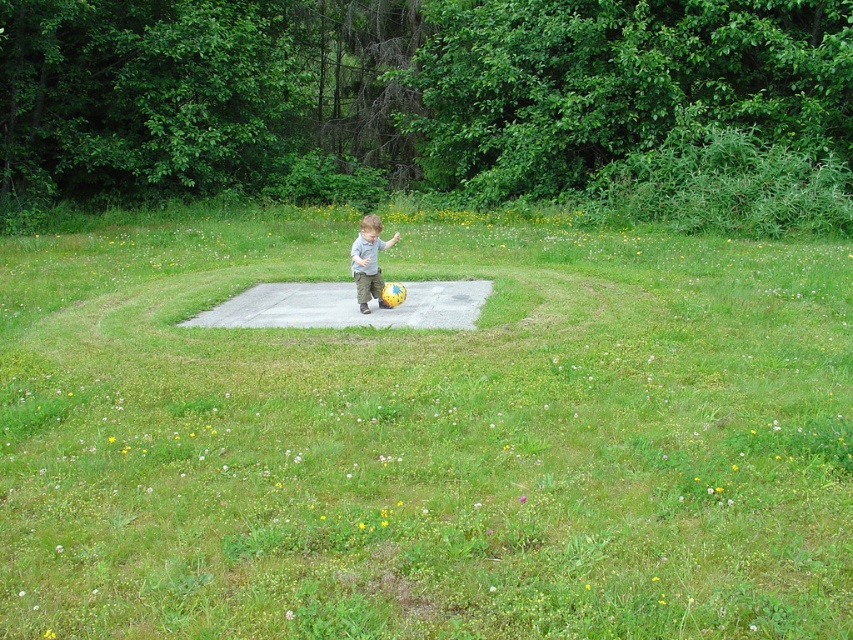
Question: Which point is closer to the camera?

Choices:
 (A) (296, 438)
 (B) (360, 259)

Answer: (A)

Question: Which point is farther from the camera taking this photo?

Choices:
 (A) (517, 256)
 (B) (367, 275)

Answer: (A)

Question: Where is concrete slab at center located in relation to matte gray shirt at center in the image?

Choices:
 (A) above
 (B) below

Answer: (B)

Question: Can you confirm if concrete slab at center is positioned to the left of matte gray shirt at center?

Choices:
 (A) no
 (B) yes

Answer: (B)

Question: Does concrete slab at center appear on the left side of matte gray shirt at center?

Choices:
 (A) yes
 (B) no

Answer: (A)

Question: Which point appears farthest from the camera in this image?

Choices:
 (A) (369, 216)
 (B) (416, 362)

Answer: (A)